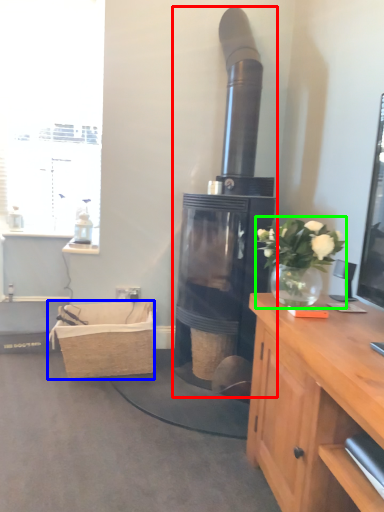
Question: Based on their relative distances, which object is nearer to fireplace (highlighted by a red box)? Choose from picnic basket (highlighted by a blue box) and houseplant (highlighted by a green box).

Choices:
 (A) picnic basket
 (B) houseplant

Answer: (A)